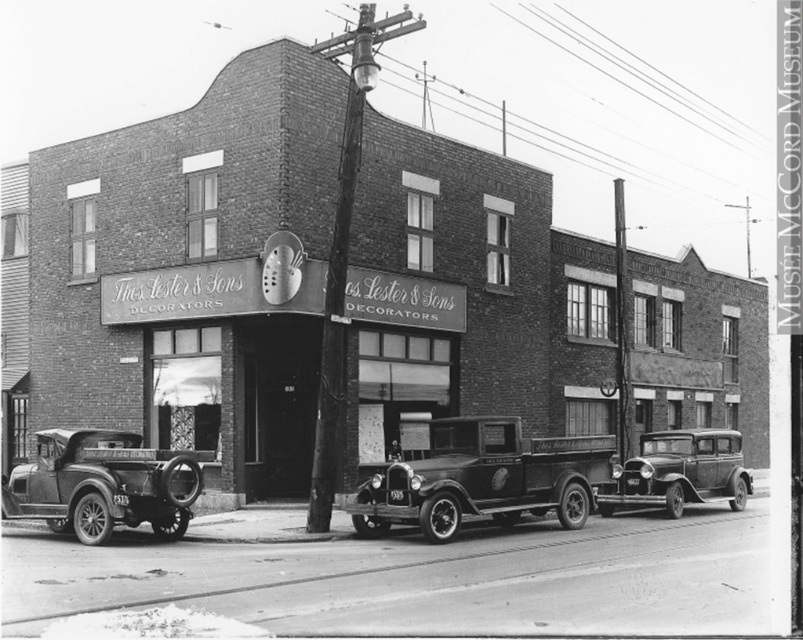
You are a photographer trying to capture the two cars in the scene. You want to ensure that both the polished chrome car at left and the shiny black sedan at center are clearly visible in your shot. Given their sizes, which car should you position closer to the camera to maintain their visibility in the frame?

The polished chrome car at left is larger in size than the shiny black sedan at center. To ensure both are clearly visible, you should position the smaller shiny black sedan at center closer to the camera so it appears larger in the frame, balancing their sizes.

You are a delivery person trying to park your new delivery van which is 2 meters wide. You see the polished wood pickup truck at center and the smooth metal sign at center. Can your van fit between them without hitting the sign?

The polished wood pickup truck at center has a lesser width compared to smooth metal sign at center. Since the sign is wider, there is enough space between them for the van to fit as long as it stays centered. However, the exact distance isn not specified, so caution is advised.